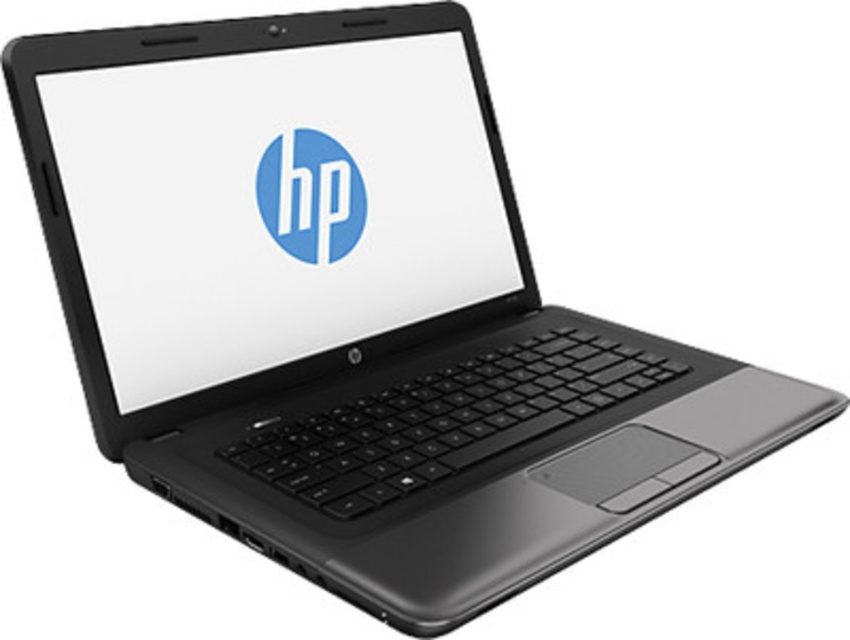
Which is behind, point (89, 150) or point (279, 196)?

Positioned behind is point (279, 196).

Is point (437, 113) farther from viewer compared to point (332, 150)?

That is True.

Which is behind, point (434, 51) or point (306, 198)?

The point (434, 51) is more distant.

Where is `matte black screen at center`? This screenshot has width=850, height=640. matte black screen at center is located at coordinates click(x=275, y=202).